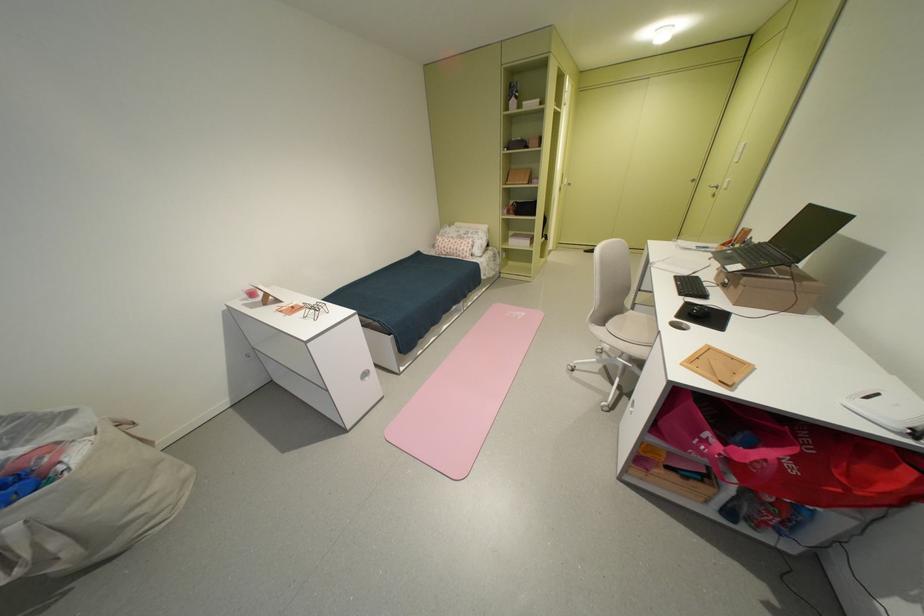
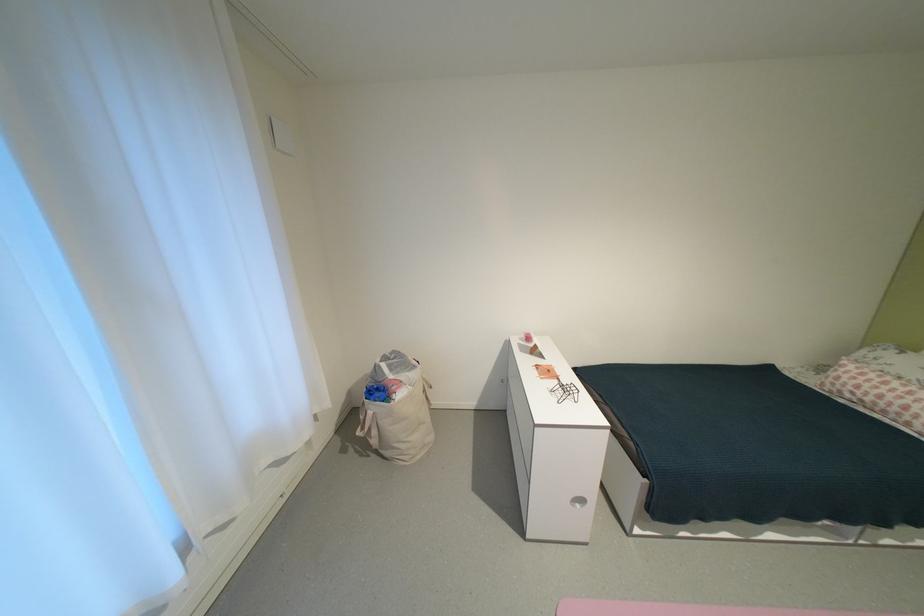
Find the pixel in the second image that matches point 455,251 in the first image.

(867, 392)